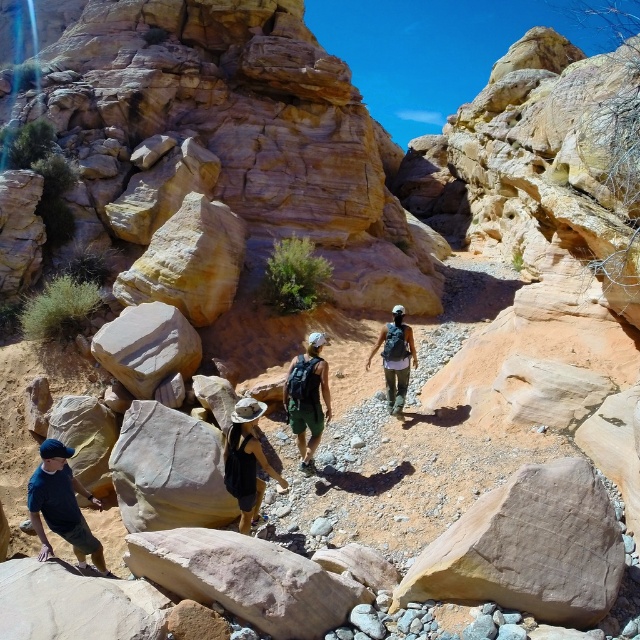
You are a photographer trying to capture a photo of the brown fabric hat at center and the matte black backpack at center. Since you want to ensure both are in focus, you need to know which object is closer to the camera. Based on the scene description, which object is closer?

The brown fabric hat at center is shorter than matte black backpack at center, so the brown fabric hat at center is closer to the camera.